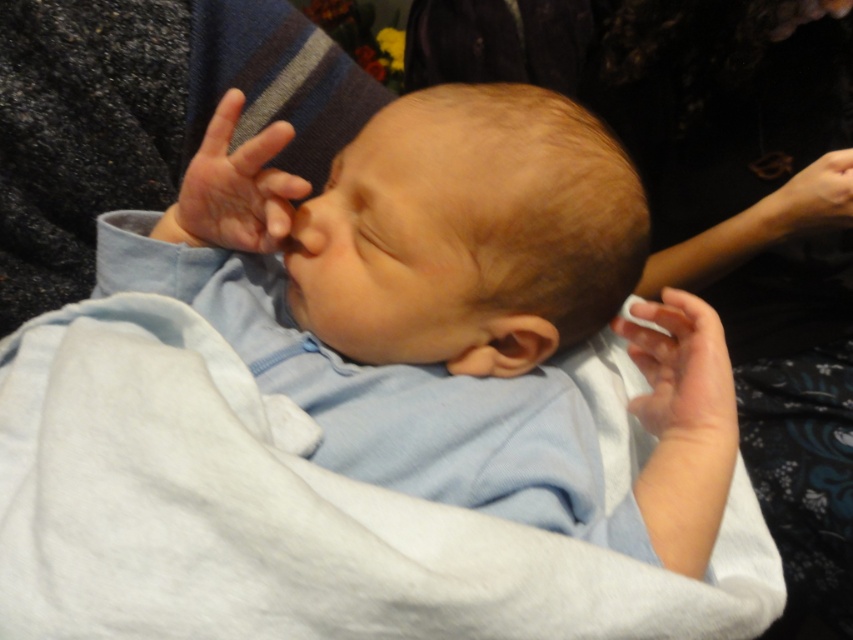
Does light blue fabric at center have a lesser width compared to smooth flesh nose at center?

In fact, light blue fabric at center might be wider than smooth flesh nose at center.

Is light blue fabric at center further to camera compared to smooth flesh nose at center?

No.

Where is `light blue fabric at center`? The image size is (853, 640). light blue fabric at center is located at coordinates pyautogui.click(x=453, y=308).

Locate an element on the screen. The width and height of the screenshot is (853, 640). light blue fabric at center is located at coordinates (453, 308).

Does dark fabric at upper center come in front of smooth skin hand at upper center?

No, dark fabric at upper center is behind smooth skin hand at upper center.

Can you confirm if dark fabric at upper center is positioned below smooth skin hand at upper center?

No, dark fabric at upper center is not below smooth skin hand at upper center.

At what (x,y) coordinates should I click in order to perform the action: click on dark fabric at upper center. Please return your answer as a coordinate pair (x, y). Looking at the image, I should click on (666, 84).

Which is above, white matte finger at center or smooth skin hand at upper center?

smooth skin hand at upper center

Which is more to the left, white matte finger at center or smooth skin hand at upper center?

Positioned to the left is smooth skin hand at upper center.

Does point (705, 355) come behind point (227, 182)?

That is True.

The width and height of the screenshot is (853, 640). I want to click on white matte finger at center, so click(682, 376).